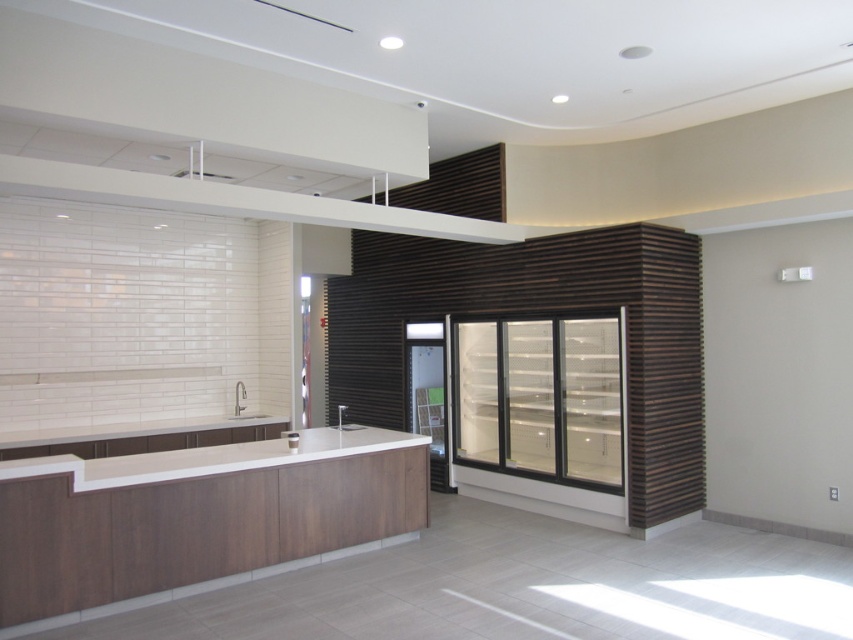
Between clear glass refrigerator at center and white glossy sink at center, which one has more height?

Standing taller between the two is clear glass refrigerator at center.

Which is more to the left, clear glass refrigerator at center or white glossy sink at center?

From the viewer's perspective, white glossy sink at center appears more on the left side.

Is point (619, 378) more distant than point (256, 413)?

No, it is in front of (256, 413).

The height and width of the screenshot is (640, 853). Find the location of `clear glass refrigerator at center`. clear glass refrigerator at center is located at coordinates [538, 397].

From the picture: Can you confirm if white glossy countertop at center is taller than matte white sink at center?

In fact, white glossy countertop at center may be shorter than matte white sink at center.

Does white glossy countertop at center appear on the left side of matte white sink at center?

Indeed, white glossy countertop at center is positioned on the left side of matte white sink at center.

Is point (321, 436) more distant than point (345, 412)?

No.

Where is `white glossy countertop at center`? The height and width of the screenshot is (640, 853). white glossy countertop at center is located at coordinates (236, 456).

Is white glossy sink at center to the right of matte white sink at center from the viewer's perspective?

In fact, white glossy sink at center is to the left of matte white sink at center.

Which is in front, point (265, 413) or point (339, 420)?

Point (339, 420) is in front.

You are a GUI agent. You are given a task and a screenshot of the screen. Output one action in this format:
    pyautogui.click(x=<x>, y=<y>)
    Task: Click on the white glossy sink at center
    
    Given the screenshot: What is the action you would take?
    pyautogui.click(x=242, y=403)